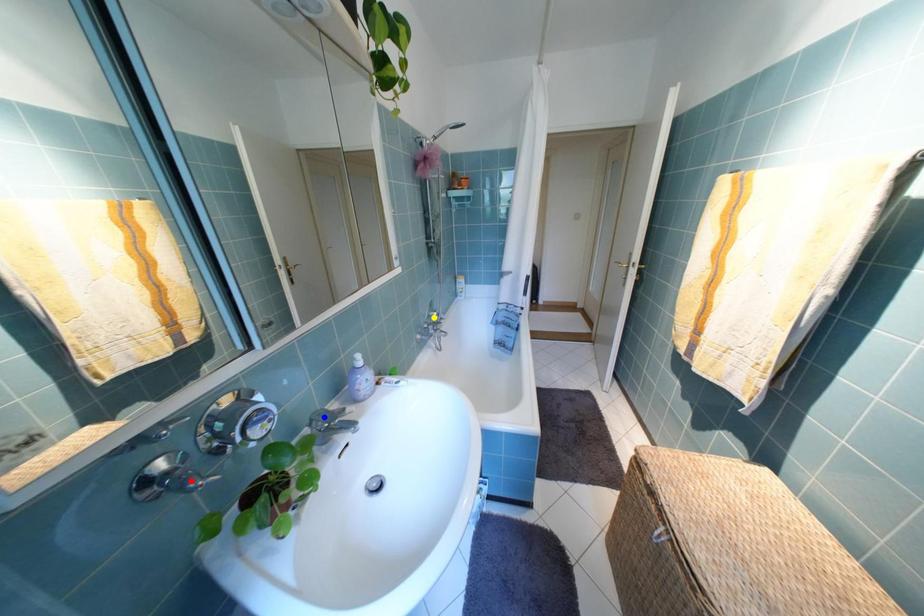
Order these from nearest to farthest:
- blue point
- red point
- yellow point

red point
blue point
yellow point